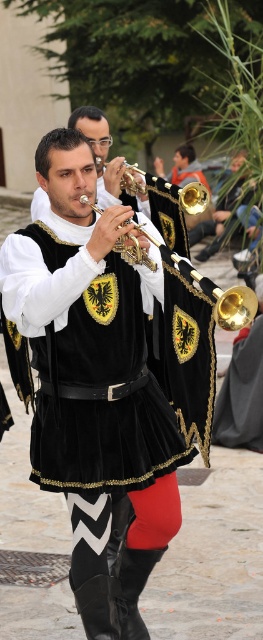
Question: Which point is closer to the camera?

Choices:
 (A) velvet black trumpet at center
 (B) gold polished trumpet at center
 (C) gold shiny trumpet at center
 (D) gold metallic trumpet at center

Answer: (B)

Question: Is velvet black trumpet at center bigger than gold shiny trumpet at center?

Choices:
 (A) no
 (B) yes

Answer: (B)

Question: Among these points, which one is nearest to the camera?

Choices:
 (A) (189, 182)
 (B) (134, 243)

Answer: (B)

Question: Can you confirm if velvet black trumpet at center is positioned above gold metallic trumpet at center?

Choices:
 (A) no
 (B) yes

Answer: (A)

Question: Estimate the real-world distances between objects in this image. Which object is closer to the velvet black trumpet at center?

Choices:
 (A) gold polished trumpet at center
 (B) gold shiny trumpet at center

Answer: (B)

Question: Is velvet black trumpet at center behind gold shiny trumpet at center?

Choices:
 (A) no
 (B) yes

Answer: (A)